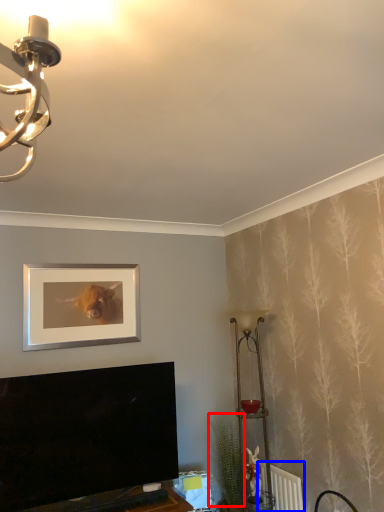
Question: Among these objects, which one is farthest to the camera, plant (highlighted by a red box) or radiator (highlighted by a blue box)?

Choices:
 (A) plant
 (B) radiator

Answer: (A)